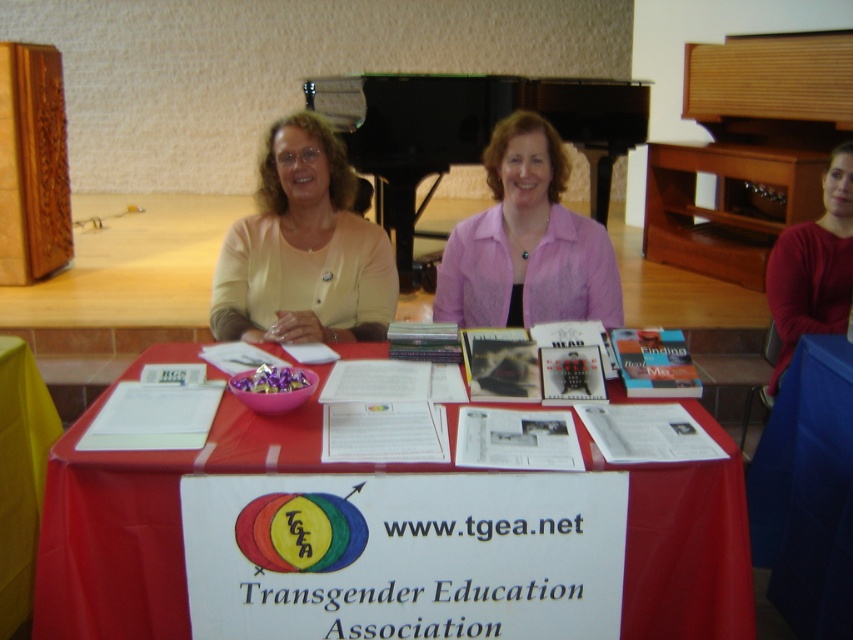
Can you confirm if matte yellow sweater at center is shorter than pink sheer blouse at center?

In fact, matte yellow sweater at center may be taller than pink sheer blouse at center.

Is matte yellow sweater at center to the left of pink sheer blouse at center from the viewer's perspective?

Correct, you'll find matte yellow sweater at center to the left of pink sheer blouse at center.

Which is in front, point (259, 332) or point (556, 150)?

Positioned in front is point (259, 332).

The height and width of the screenshot is (640, 853). Identify the location of matte yellow sweater at center. (303, 250).

How distant is pink sheer blouse at center from yellow fabric at lower left?

pink sheer blouse at center is 4.58 feet from yellow fabric at lower left.

Is point (558, 218) less distant than point (13, 566)?

No, (558, 218) is behind (13, 566).

Where is `pink sheer blouse at center`? The image size is (853, 640). pink sheer blouse at center is located at coordinates (526, 243).

Who is taller, pink sheer blouse at center or red matte shirt at upper right?

red matte shirt at upper right is taller.

Is point (553, 150) farther from viewer compared to point (828, 211)?

No, it is in front of (828, 211).

Is point (445, 276) positioned behind point (779, 321)?

No, it is in front of (779, 321).

At what (x,y) coordinates should I click in order to perform the action: click on pink sheer blouse at center. Please return your answer as a coordinate pair (x, y). Looking at the image, I should click on (526, 243).